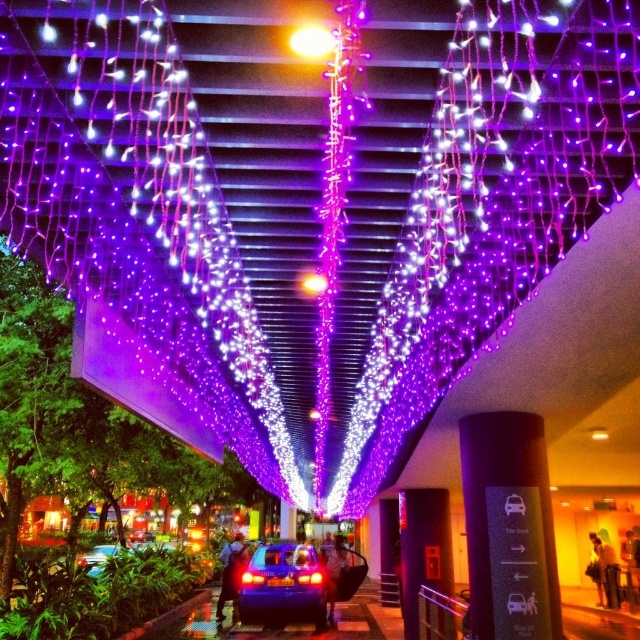
You are a delivery person trying to park your shiny blue car at center. There is another metallic blue car at center in the way. Can you park your car here?

The shiny blue car at center is already positioned over metallic blue car at center, meaning the parking spot is occupied. You cannot park there.

You are standing on the sidewalk and see both the shiny blue car at center and the metallic blue car at center. Which one is closer to you?

The shiny blue car at center is closer to you because it is further to the viewer than the metallic blue car at center.

You are a delivery person trying to park your shiny blue car at center in a parking spot that can only accommodate vehicles smaller than the metallic blue car at center. Can your car fit in the spot?

→ The shiny blue car at center occupies less space than the metallic blue car at center, so yes, the delivery person can park their shiny blue car at center in the spot since it is smaller than the metallic blue car at center.